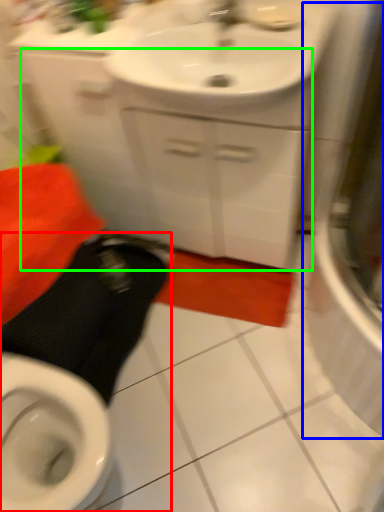
Question: Based on their relative distances, which object is nearer to squat (highlighted by a red box)? Choose from screen door (highlighted by a blue box) and cabinetry (highlighted by a green box).

Choices:
 (A) screen door
 (B) cabinetry

Answer: (B)